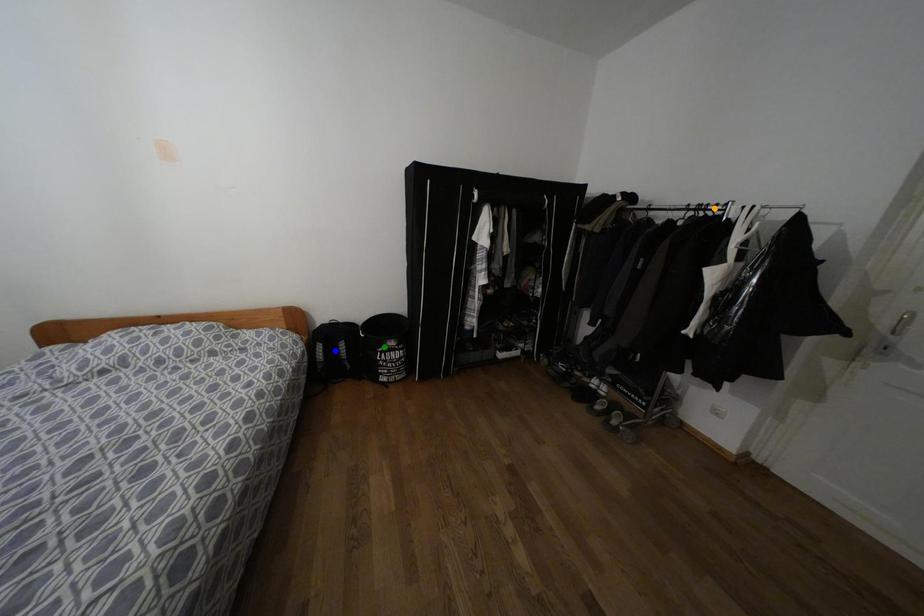
Order these from nearest to farthest:
A) blue point
B) green point
C) orange point

orange point
blue point
green point